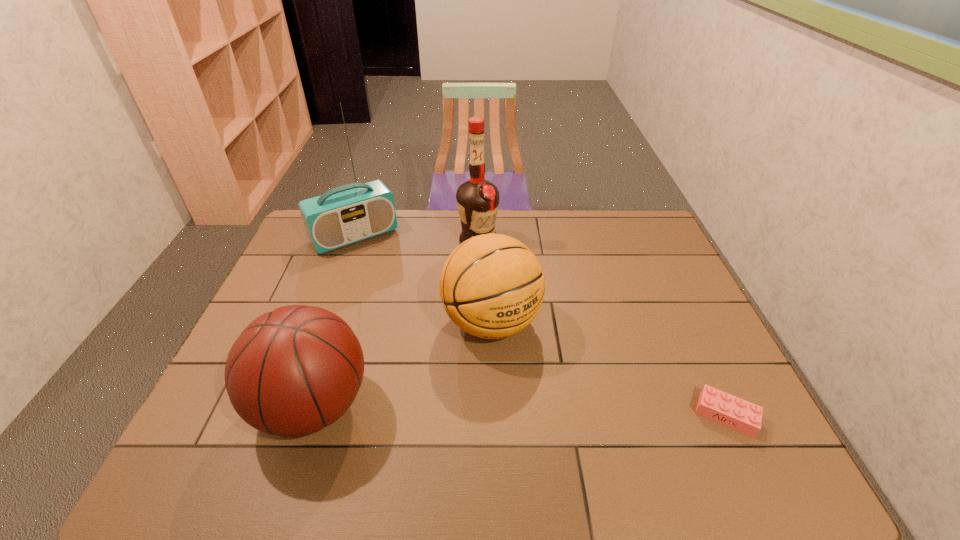
Locate an element on the screen. This screenshot has height=540, width=960. vacant space on the desktop that is between the left basketball and the Lego and is positioned on the front and back of the liquor is located at coordinates (573, 411).

I want to click on vacant space on the desktop that is between the left basketball and the shortest object and is positioned on the front panel of the radio receiver, so click(x=475, y=409).

Where is `vacant space on the desktop that is between the left basketball and the Lego and is positioned on the surface of the right basketball near the brand logo`? vacant space on the desktop that is between the left basketball and the Lego and is positioned on the surface of the right basketball near the brand logo is located at coordinates (562, 411).